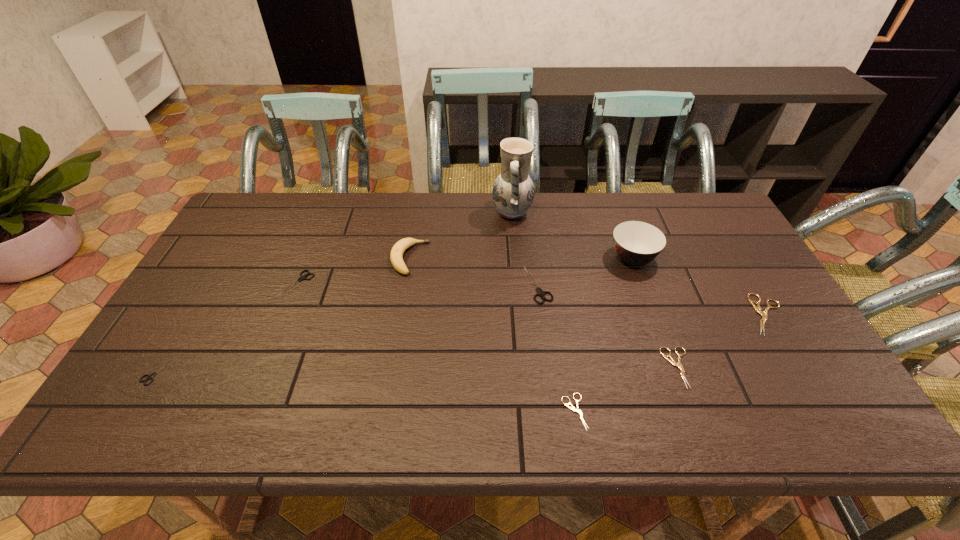
The height and width of the screenshot is (540, 960). Find the location of `pottery`. pottery is located at coordinates (513, 190).

Find the location of `the farthest object`. the farthest object is located at coordinates (513, 190).

At what (x,y) coordinates should I click in order to perform the action: click on soup bowl. Please return your answer as a coordinate pair (x, y). Image resolution: width=960 pixels, height=540 pixels. Looking at the image, I should click on (636, 243).

This screenshot has width=960, height=540. In order to click on the seventh object from right to left in this screenshot , I will do `click(396, 256)`.

You are a GUI agent. You are given a task and a screenshot of the screen. Output one action in this format:
    pyautogui.click(x=<x>, y=<y>)
    Task: Click on the banana
    Image resolution: width=960 pixels, height=540 pixels.
    Given the screenshot: What is the action you would take?
    pyautogui.click(x=396, y=256)

The image size is (960, 540). I want to click on the rightmost black shears, so click(540, 292).

Locate an element on the screen. The width and height of the screenshot is (960, 540). the biggest black shears is located at coordinates (540, 292).

What are the coordinates of `the second shears from left to right` in the screenshot? It's located at (302, 277).

This screenshot has width=960, height=540. I want to click on the second black shears from left to right, so click(302, 277).

At what (x,y) coordinates should I click in order to perform the action: click on the biggest beige shears. Please return your answer as a coordinate pair (x, y). Looking at the image, I should click on (764, 315).